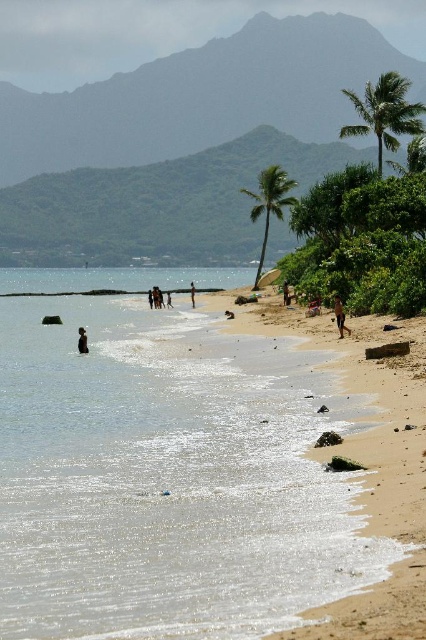
Which is more to the right, green leafy palm tree at upper right or tan skin person at center?

From the viewer's perspective, green leafy palm tree at upper right appears more on the right side.

The width and height of the screenshot is (426, 640). Describe the element at coordinates (385, 113) in the screenshot. I see `green leafy palm tree at upper right` at that location.

In order to click on green leafy palm tree at upper right in this screenshot , I will do `click(385, 113)`.

Who is positioned more to the right, green leafy palm tree at center or smooth skin person at center?

From the viewer's perspective, green leafy palm tree at center appears more on the right side.

Is point (285, 173) positioned in front of point (192, 288)?

No, it is not.

This screenshot has width=426, height=640. What do you see at coordinates (270, 204) in the screenshot? I see `green leafy palm tree at center` at bounding box center [270, 204].

I want to click on green leafy palm tree at center, so [x=270, y=204].

Who is more forward, (x=80, y=344) or (x=227, y=314)?

Point (x=80, y=344) is in front.

Is point (80, 326) behind point (232, 314)?

Yes.

Find the location of `dark brown skin at lower left`. dark brown skin at lower left is located at coordinates (83, 340).